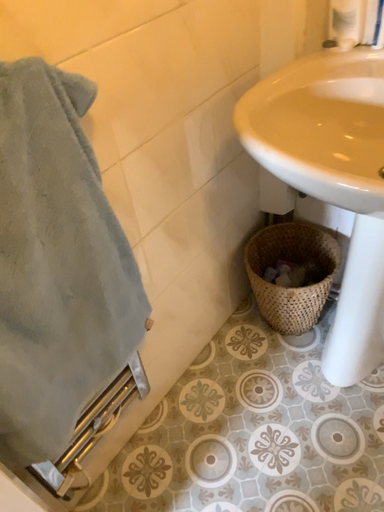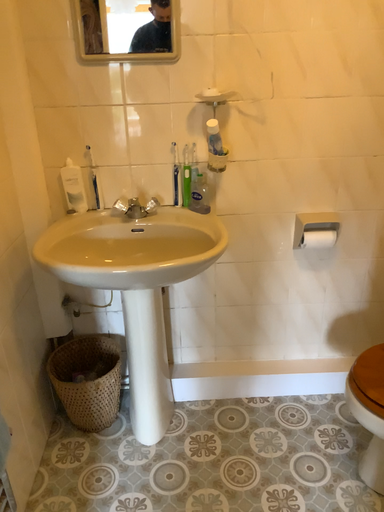
Question: Which way did the camera rotate in the video?

Choices:
 (A) rotated upward
 (B) rotated downward

Answer: (A)